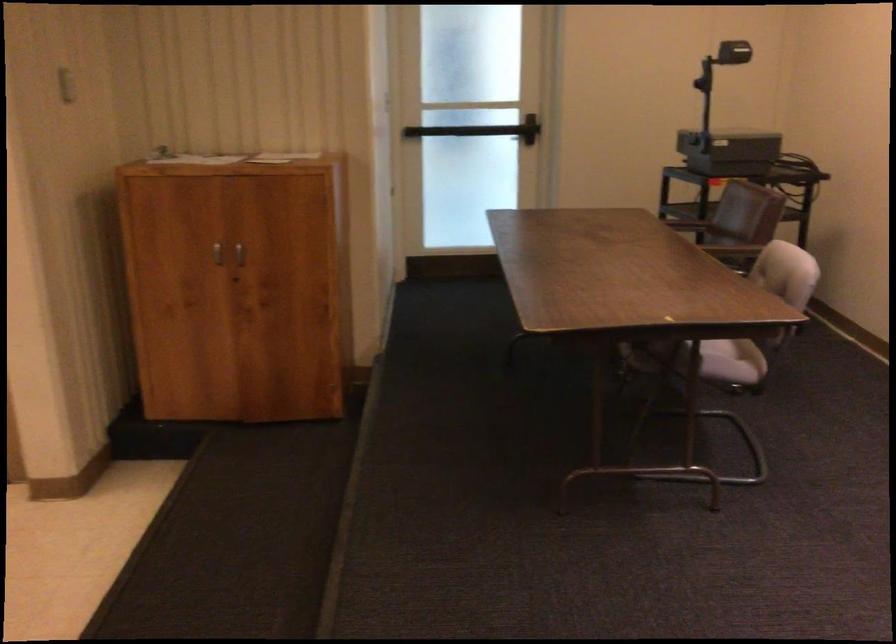
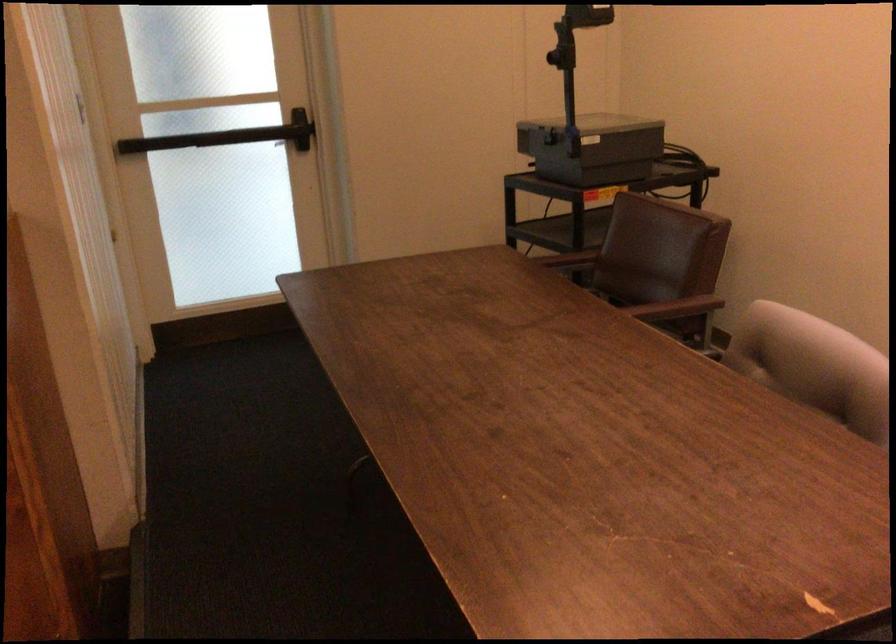
The point at (461, 129) is marked in the first image. Where is the corresponding point in the second image?

(207, 138)